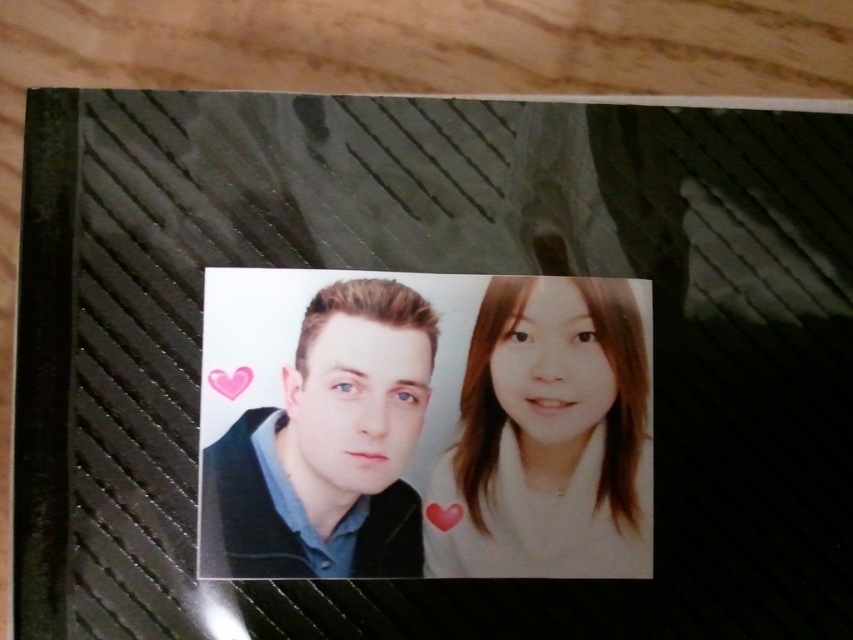
Question: From the image, what is the correct spatial relationship of white matte hair at center in relation to matte black sweater at center?

Choices:
 (A) left
 (B) right

Answer: (B)

Question: Can you confirm if white matte hair at center is bigger than matte black sweater at center?

Choices:
 (A) no
 (B) yes

Answer: (B)

Question: Can you confirm if white matte hair at center is smaller than matte black sweater at center?

Choices:
 (A) no
 (B) yes

Answer: (A)

Question: Which of the following is the farthest from the observer?

Choices:
 (A) [599, 538]
 (B) [387, 381]

Answer: (B)

Question: Which object is farther from the camera taking this photo?

Choices:
 (A) matte black sweater at center
 (B) white matte hair at center

Answer: (B)